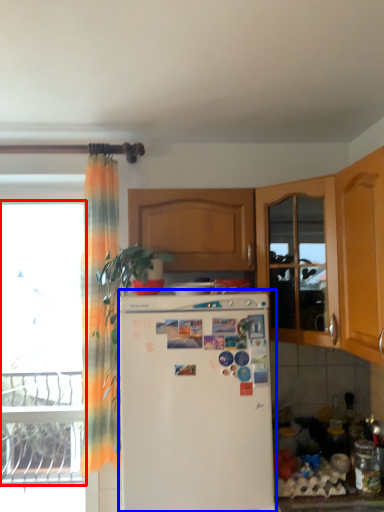
Question: Which object appears farthest to the camera in this image, window (highlighted by a red box) or refrigerator (highlighted by a blue box)?

Choices:
 (A) window
 (B) refrigerator

Answer: (A)